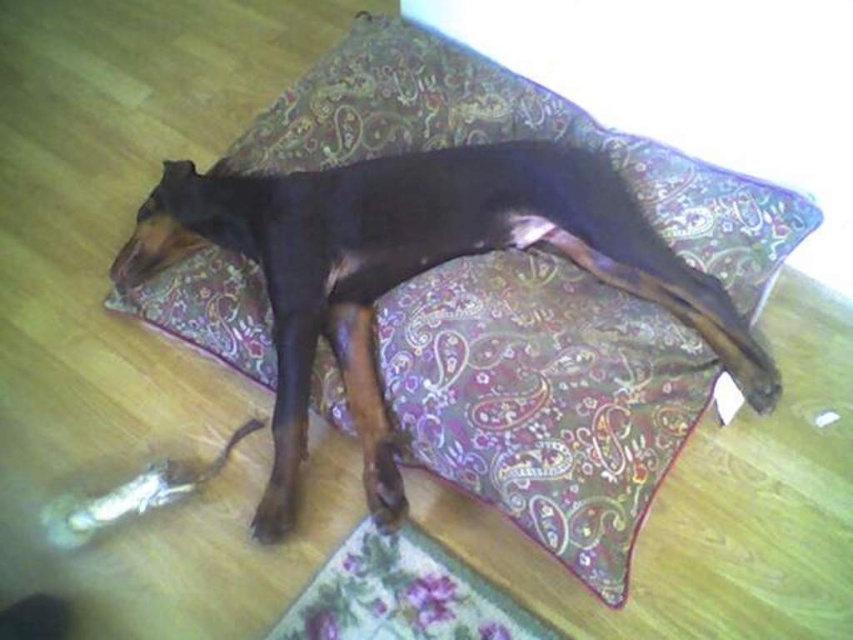
Question: Where is black glossy dog at center located in relation to floral fabric mat at lower center in the image?

Choices:
 (A) below
 (B) above

Answer: (B)

Question: Can you confirm if black glossy dog at center is thinner than floral fabric mat at lower center?

Choices:
 (A) no
 (B) yes

Answer: (A)

Question: In this image, where is black glossy dog at center located relative to floral fabric mat at lower center?

Choices:
 (A) below
 (B) above

Answer: (B)